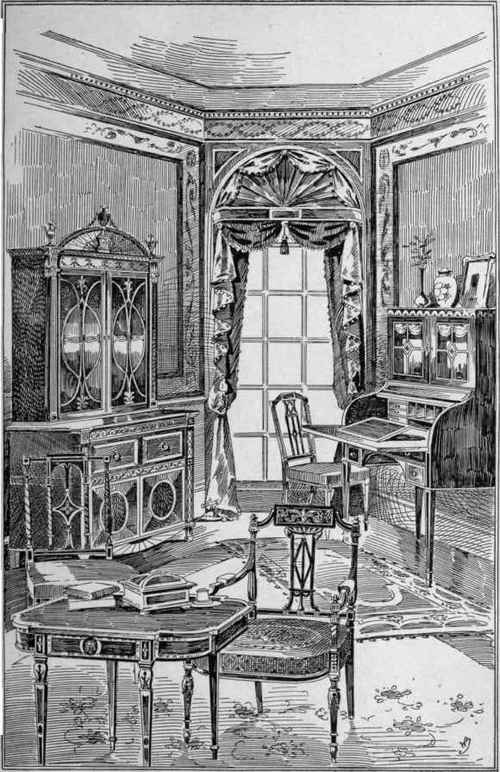
The image size is (500, 772). Find the location of `handle of left drawer`. handle of left drawer is located at coordinates (116, 456).